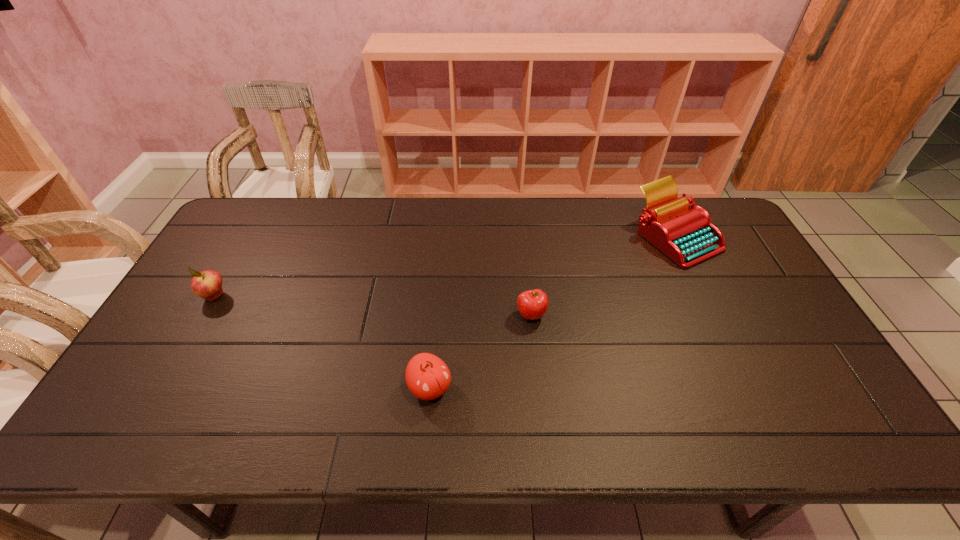
Locate an element on the screen. This screenshot has width=960, height=540. vacant point located 0.190m on the right of the shortest apple is located at coordinates (614, 315).

Where is `object that is at the far edge`? Image resolution: width=960 pixels, height=540 pixels. object that is at the far edge is located at coordinates (687, 236).

Image resolution: width=960 pixels, height=540 pixels. In order to click on object that is at the near edge in this screenshot , I will do `click(427, 376)`.

Locate an element on the screen. This screenshot has width=960, height=540. object that is at the left edge is located at coordinates (207, 284).

Find the location of `object at the right edge`. object at the right edge is located at coordinates (687, 236).

Locate an element on the screen. object present at the far right corner is located at coordinates (687, 236).

At what (x,y) coordinates should I click in order to perform the action: click on vacant space at the far edge of the desktop. Please return your answer as a coordinate pair (x, y). Looking at the image, I should click on (282, 233).

At what (x,y) coordinates should I click in order to perform the action: click on free space at the near edge of the desktop. Please return your answer as a coordinate pair (x, y). The height and width of the screenshot is (540, 960). Looking at the image, I should click on [396, 423].

The width and height of the screenshot is (960, 540). In order to click on vacant region at the left edge in this screenshot , I will do `click(240, 246)`.

Locate an element on the screen. The height and width of the screenshot is (540, 960). free space at the right edge of the desktop is located at coordinates (757, 271).